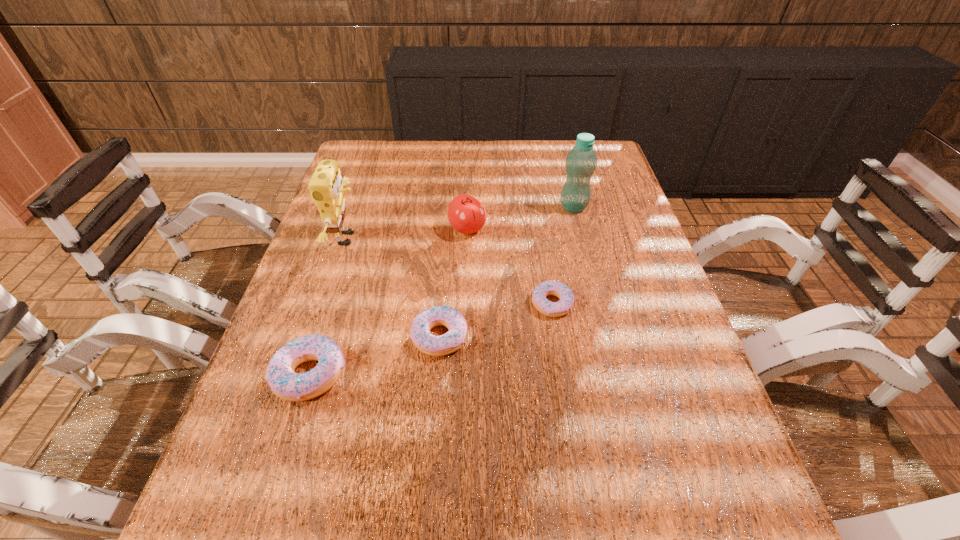
Find the location of a particular element. This screenshot has width=960, height=540. free spot between the fourth shortest object and the second tallest doughnut is located at coordinates (454, 283).

This screenshot has height=540, width=960. I want to click on free space between the water bottle and the apple, so click(520, 218).

You are a GUI agent. You are given a task and a screenshot of the screen. Output one action in this format:
    pyautogui.click(x=<x>, y=<y>)
    Task: Click on the fifth closest object relative to the second tallest doughnut
    The image size is (960, 540).
    Given the screenshot: What is the action you would take?
    pyautogui.click(x=581, y=161)

Identify the location of object that is the third closest to the fifth tallest object. The height and width of the screenshot is (540, 960). (326, 186).

Locate an element on the screen. The image size is (960, 540). doughnut identified as the closest to the fourth shortest object is located at coordinates (551, 287).

At what (x,y) coordinates should I click in order to perform the action: click on doughnut that stands as the closest to the apple. Please return your answer as a coordinate pair (x, y). This screenshot has height=540, width=960. Looking at the image, I should click on (551, 287).

Locate an element on the screen. This screenshot has height=540, width=960. free space that satisfies the following two spatial constraints: 1. on the front side of the shortest doughnut; 2. on the right side of the apple is located at coordinates (466, 304).

Where is `free space that satisfies the following two spatial constraints: 1. at the front cap of the rightmost object; 2. on the face of the sponge`? The width and height of the screenshot is (960, 540). free space that satisfies the following two spatial constraints: 1. at the front cap of the rightmost object; 2. on the face of the sponge is located at coordinates (582, 239).

The height and width of the screenshot is (540, 960). I want to click on vacant area in the image that satisfies the following two spatial constraints: 1. on the front side of the third tallest object; 2. on the right side of the rightmost doughnut, so click(x=466, y=304).

The height and width of the screenshot is (540, 960). I want to click on free space that satisfies the following two spatial constraints: 1. on the back side of the apple; 2. on the right side of the second shortest object, so click(x=448, y=229).